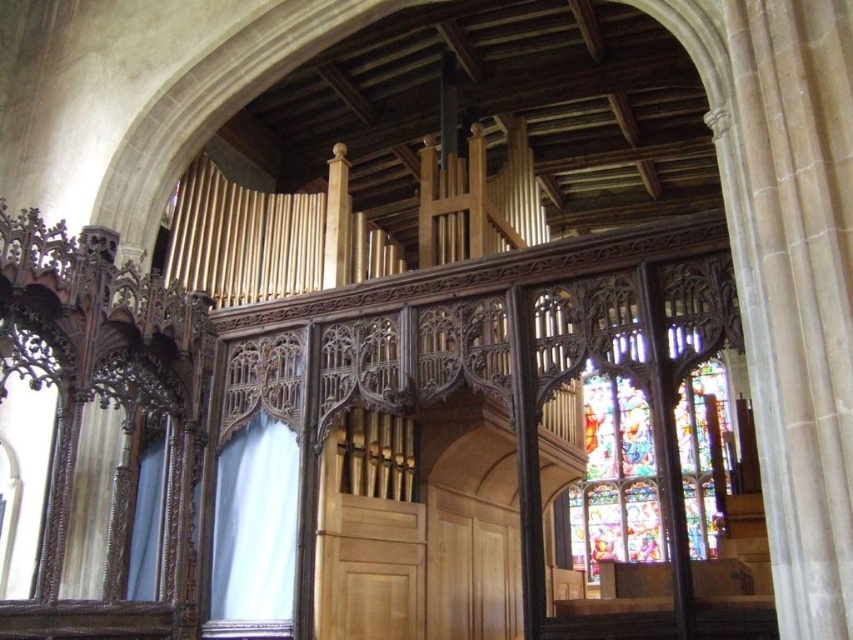
You are standing in the historic church and want to move from point A to point B. Point A is at coordinates point (656, 552) and point B is at coordinates point (279, 476). Since you need to navigate through the organ and its surrounding structures, can you determine if point A is behind point B or vice versa?

Point (656, 552) is behind point (279, 476), so point A is behind point B.